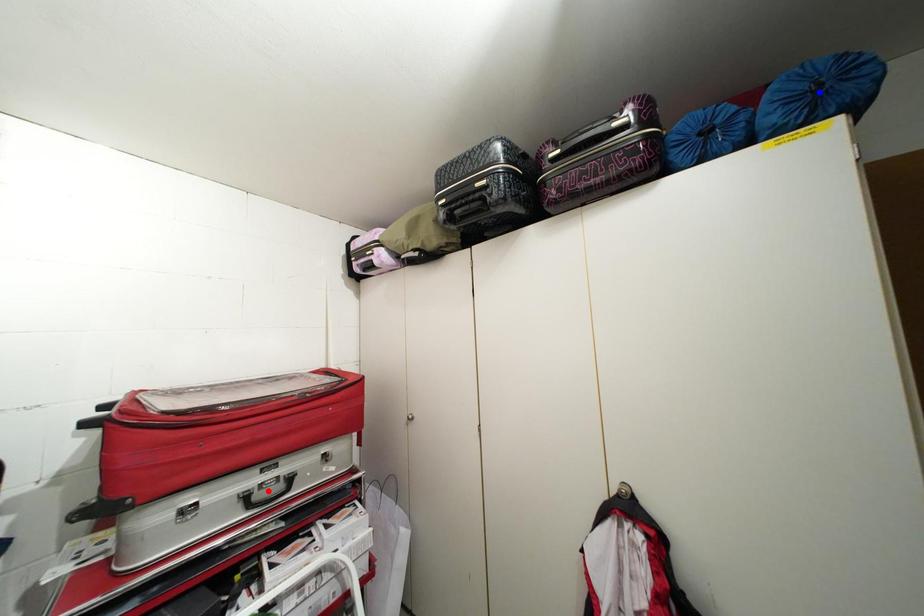
Question: In the image, two points are highlighted. Which point is nearer to the camera? Reply with the corresponding letter.

Choices:
 (A) blue point
 (B) red point

Answer: (A)